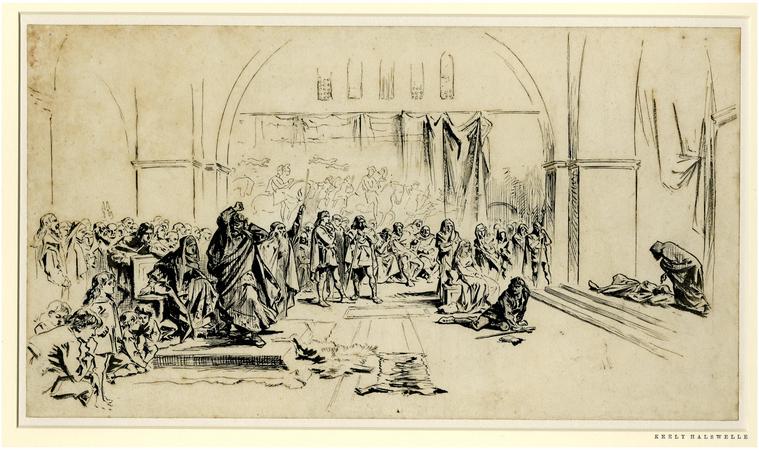
Image resolution: width=759 pixels, height=450 pixels. I want to click on art work, so click(x=372, y=208).